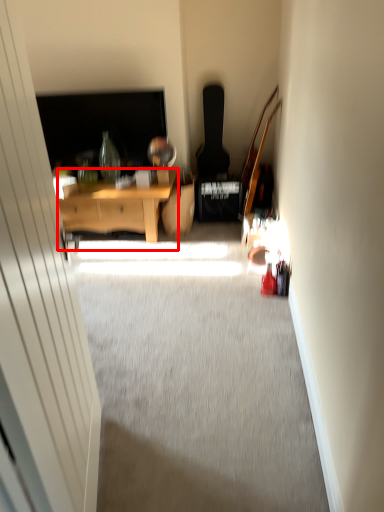
Question: From the image's perspective, considering the relative positions of desk (annotated by the red box) and glass door in the image provided, where is desk (annotated by the red box) located with respect to the staircase?

Choices:
 (A) above
 (B) below

Answer: (A)